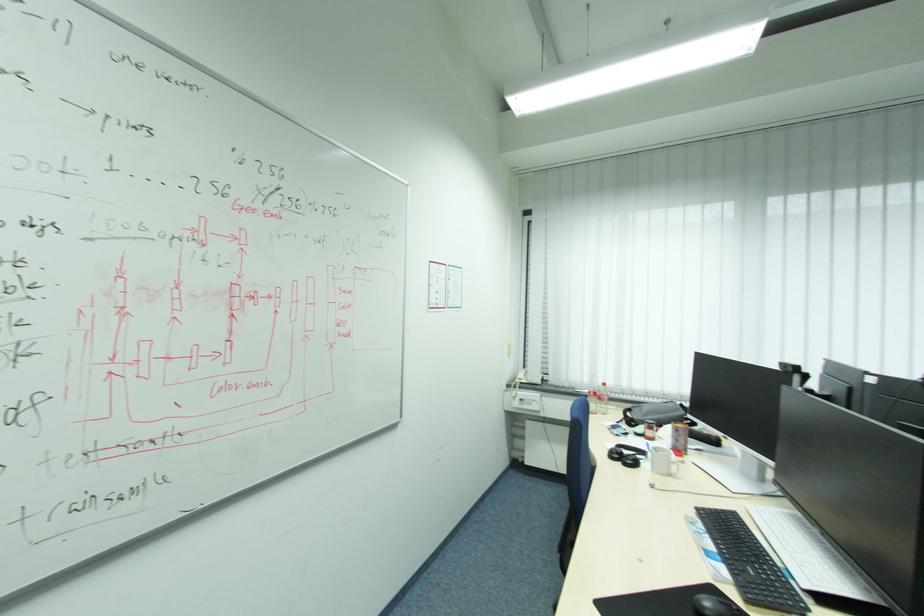
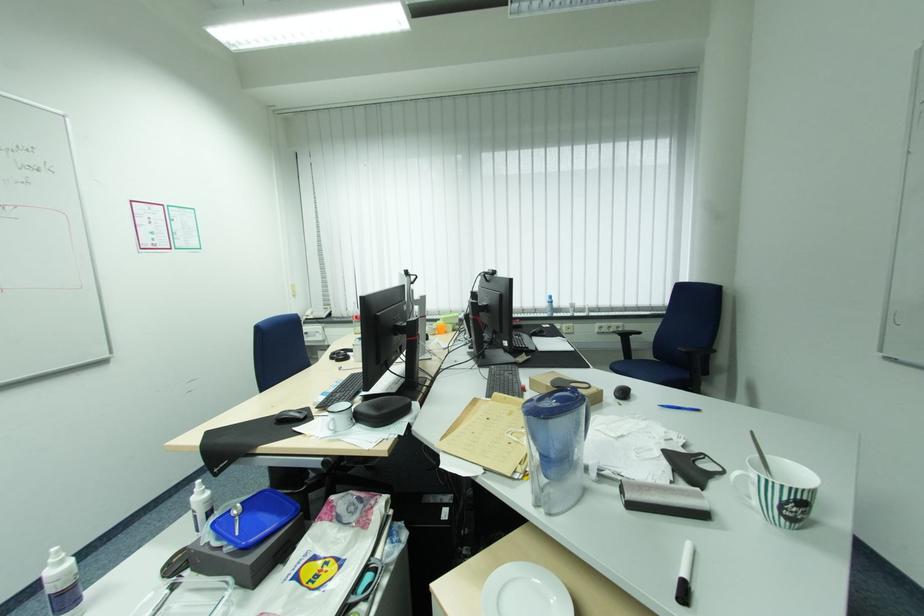
The point at (432, 575) is marked in the first image. Where is the corresponding point in the second image?

(193, 487)